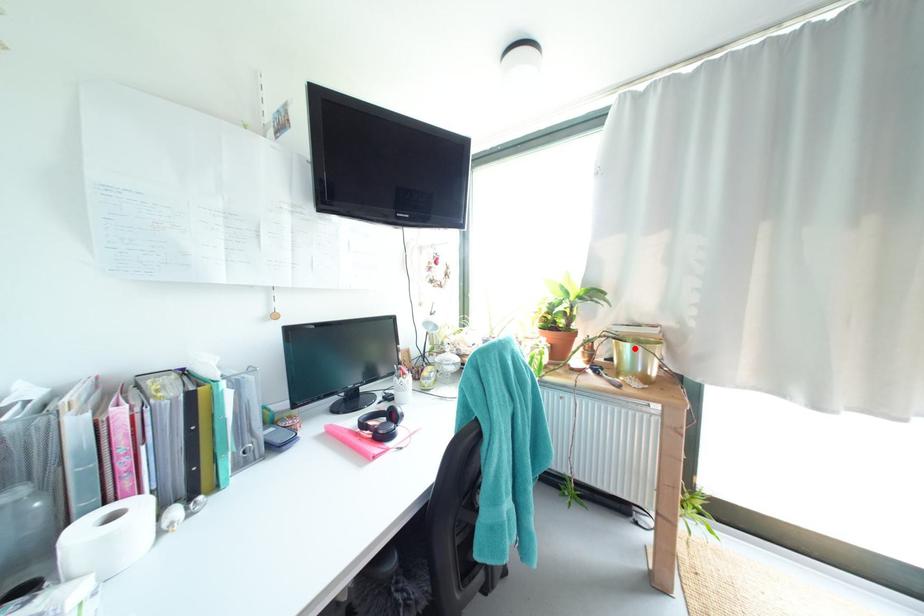
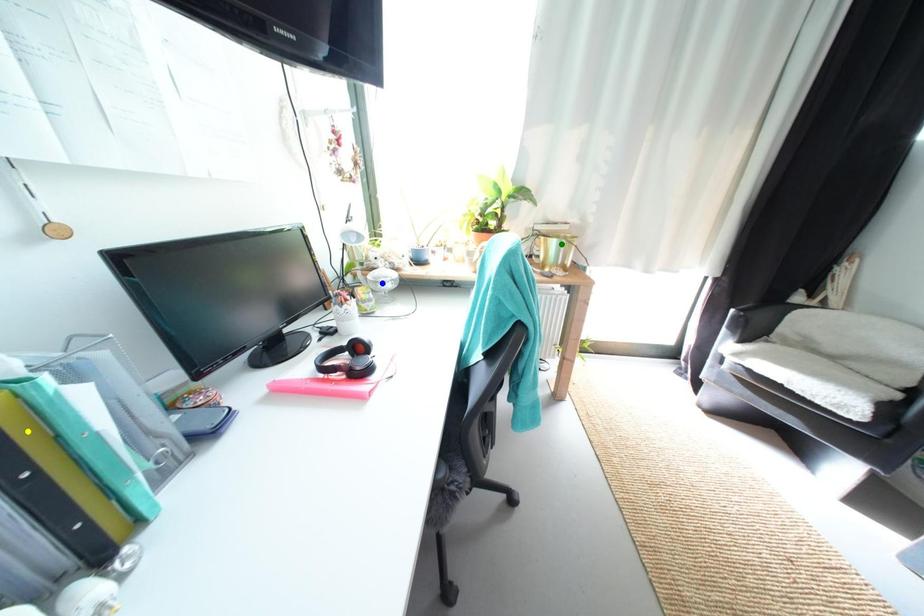
Question: I am providing you with two images of the same scene from different viewpoints. A red point is marked on the first image. You are given multiple points on the second image. Which point in image 2 is actually the same real-world point as the red point in image 1?

Choices:
 (A) blue point
 (B) yellow point
 (C) green point

Answer: (C)